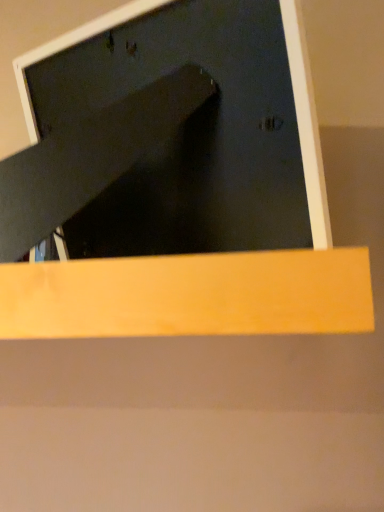
The width and height of the screenshot is (384, 512). Describe the element at coordinates (168, 136) in the screenshot. I see `matte black monitor at upper center` at that location.

Where is `matte black monitor at upper center`? The width and height of the screenshot is (384, 512). matte black monitor at upper center is located at coordinates (168, 136).

Where is `matte black monitor at upper center`? matte black monitor at upper center is located at coordinates (168, 136).